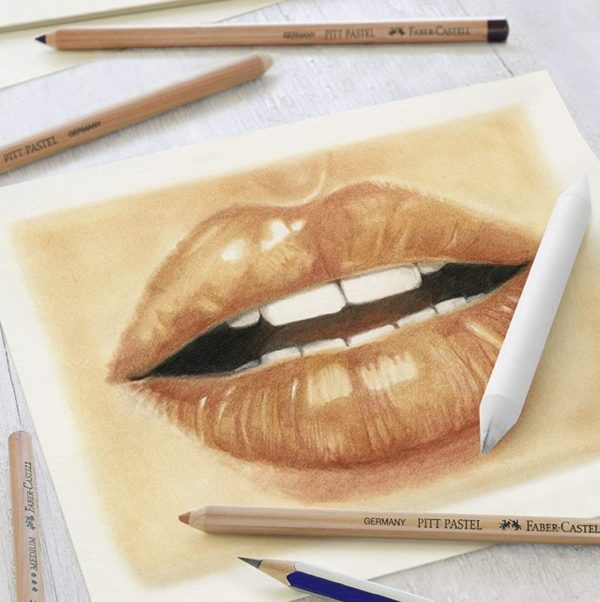
What are the coordinates of `pencils` in the screenshot? It's located at (192, 33), (123, 119), (546, 294), (416, 527), (346, 592), (28, 504).